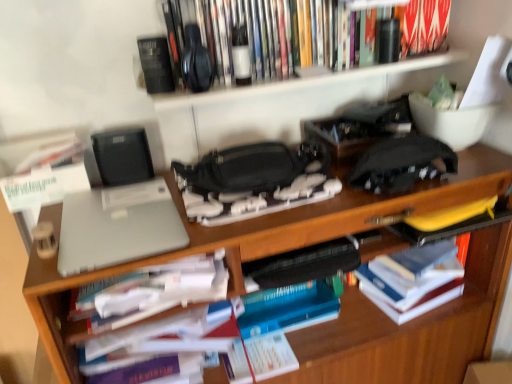
Question: Can you confirm if hardcover books at upper center, the third book in the bottom-to-top sequence, is smaller than white paper at center?

Choices:
 (A) no
 (B) yes

Answer: (A)

Question: Is hardcover books at upper center, the 1th book from the top, turned away from white paper at center?

Choices:
 (A) no
 (B) yes

Answer: (A)

Question: Can you confirm if hardcover books at upper center, the 1th book from the top, is wider than white paper at center?

Choices:
 (A) no
 (B) yes

Answer: (A)

Question: Can you confirm if hardcover books at upper center, the 1th book from the top, is taller than white paper at center?

Choices:
 (A) yes
 (B) no

Answer: (B)

Question: Is hardcover books at upper center, the third book in the bottom-to-top sequence, thinner than white paper at center?

Choices:
 (A) no
 (B) yes

Answer: (B)

Question: Considering the positions of point (293, 112) and point (490, 269), is point (293, 112) closer or farther from the camera than point (490, 269)?

Choices:
 (A) closer
 (B) farther

Answer: (B)

Question: Based on their positions, is wooden bookshelf at upper center located to the left or right of wooden desk at center?

Choices:
 (A) right
 (B) left

Answer: (A)

Question: From a real-world perspective, is wooden bookshelf at upper center positioned above or below wooden desk at center?

Choices:
 (A) above
 (B) below

Answer: (A)

Question: From the image's perspective, is wooden bookshelf at upper center above or below wooden desk at center?

Choices:
 (A) above
 (B) below

Answer: (A)

Question: Based on their sizes in the image, would you say hardcover books at upper center, the third book in the bottom-to-top sequence, is bigger or smaller than wooden bookshelf at upper center?

Choices:
 (A) big
 (B) small

Answer: (B)

Question: In terms of width, does hardcover books at upper center, the third book in the bottom-to-top sequence, look wider or thinner when compared to wooden bookshelf at upper center?

Choices:
 (A) wide
 (B) thin

Answer: (B)

Question: From the image's perspective, is hardcover books at upper center, the 1th book from the top, positioned above or below wooden bookshelf at upper center?

Choices:
 (A) below
 (B) above

Answer: (B)

Question: Would you say hardcover books at upper center, the third book in the bottom-to-top sequence, is inside or outside wooden bookshelf at upper center?

Choices:
 (A) inside
 (B) outside

Answer: (A)

Question: In the image, is hardcover books at upper center, the 1th book from the top, positioned in front of or behind wooden desk at center?

Choices:
 (A) front
 (B) behind

Answer: (B)

Question: Based on their positions, is hardcover books at upper center, the third book in the bottom-to-top sequence, located to the left or right of wooden desk at center?

Choices:
 (A) right
 (B) left

Answer: (A)